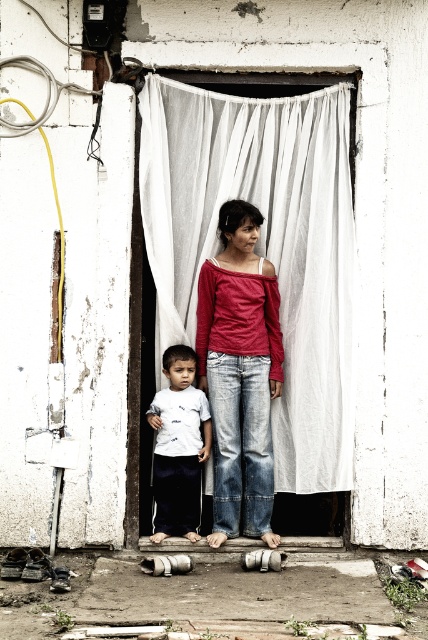
Can you confirm if matte red shirt at center is positioned above white matte shirt at center?

Indeed, matte red shirt at center is positioned over white matte shirt at center.

Image resolution: width=428 pixels, height=640 pixels. What do you see at coordinates (240, 372) in the screenshot?
I see `matte red shirt at center` at bounding box center [240, 372].

What do you see at coordinates (240, 372) in the screenshot?
I see `matte red shirt at center` at bounding box center [240, 372].

The height and width of the screenshot is (640, 428). Find the location of `matte red shirt at center`. matte red shirt at center is located at coordinates (240, 372).

Between white sheer curtain at center and white matte shirt at center, which one has more height?

white sheer curtain at center

Does point (300, 376) come closer to viewer compared to point (186, 388)?

Yes, it is in front of point (186, 388).

Where is `white sheer curtain at center`? The image size is (428, 640). white sheer curtain at center is located at coordinates (261, 244).

Which is in front, point (323, 432) or point (273, 545)?

Point (273, 545) is more forward.

Who is more distant from viewer, [345,152] or [222,371]?

Positioned behind is point [222,371].

Identify the location of white sheer curtain at center. (261, 244).